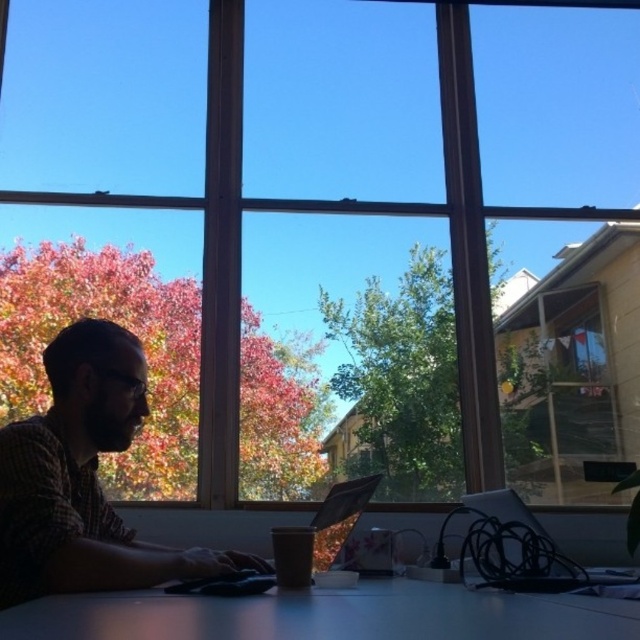
Between matte plaid shirt at left and metallic silver laptop at center, which one has more height?

matte plaid shirt at left is taller.

Is point (84, 499) positioned behind point (328, 528)?

No, (84, 499) is closer to viewer.

Which is in front, point (3, 484) or point (340, 504)?

Point (3, 484) is in front.

At what (x,y) coordinates should I click in order to perform the action: click on matte plaid shirt at left. Please return your answer as a coordinate pair (x, y). The image size is (640, 640). Looking at the image, I should click on 83,477.

This screenshot has width=640, height=640. I want to click on matte plaid shirt at left, so click(x=83, y=477).

Which is behind, point (68, 508) or point (29, 620)?

The point (68, 508) is more distant.

The width and height of the screenshot is (640, 640). What are the coordinates of `matte plaid shirt at left` in the screenshot? It's located at (83, 477).

Who is lower down, white glossy table at center or metallic silver laptop at center?

metallic silver laptop at center

What do you see at coordinates (326, 614) in the screenshot?
I see `white glossy table at center` at bounding box center [326, 614].

Which is behind, point (477, 602) or point (243, 577)?

Point (243, 577)

Locate an element on the screen. This screenshot has width=640, height=640. white glossy table at center is located at coordinates (326, 614).